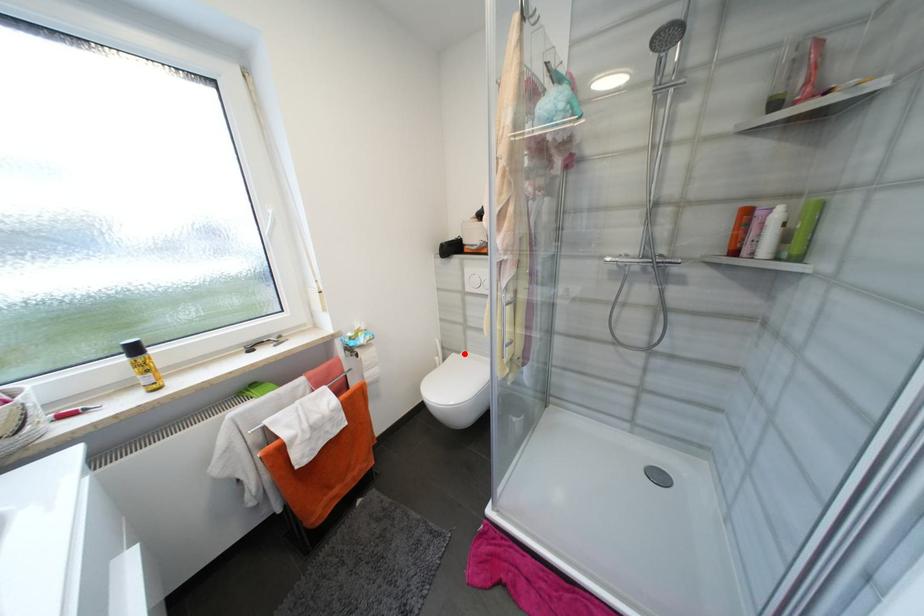
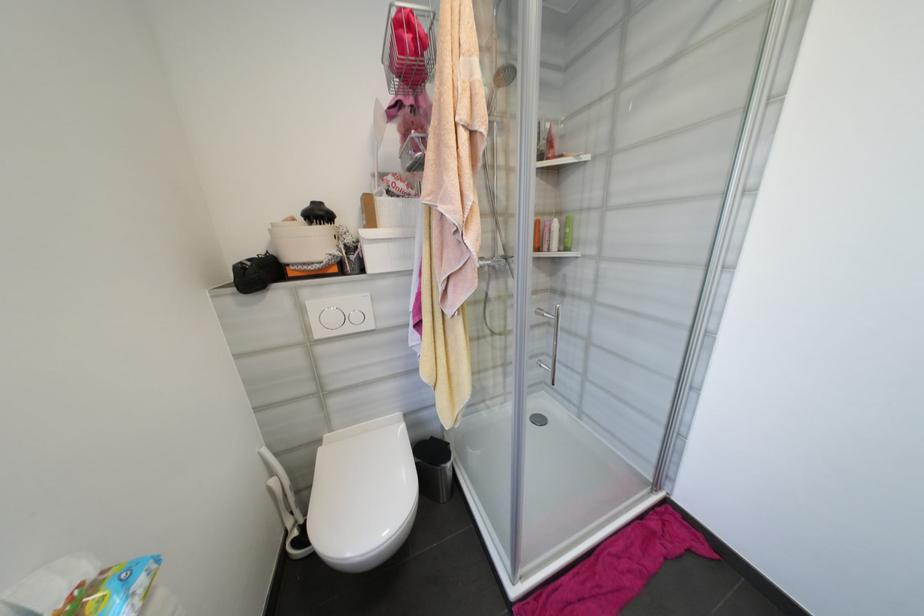
In the second image, find the point that corresponds to the highlighted location in the first image.

(325, 443)